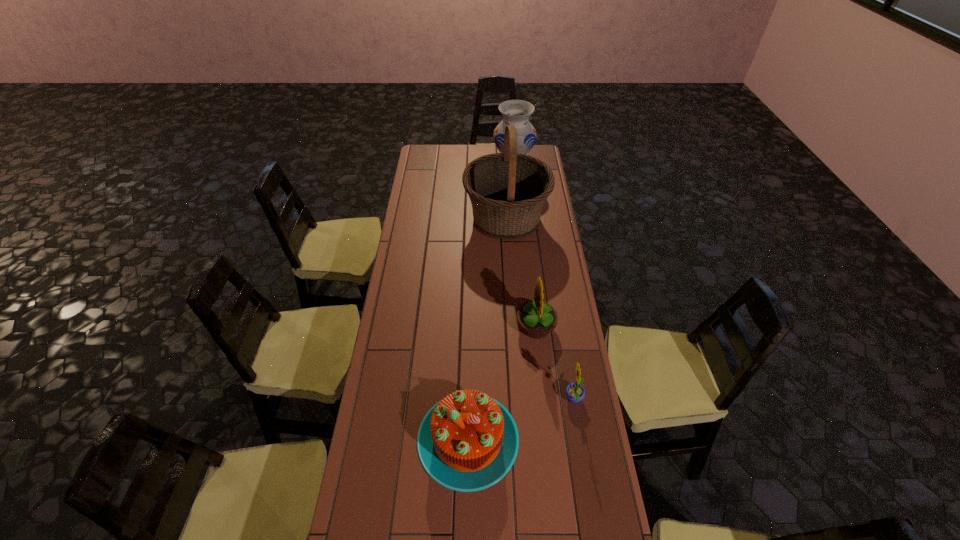
The height and width of the screenshot is (540, 960). I want to click on basket, so click(x=508, y=190).

Identify the location of the tallest object. This screenshot has height=540, width=960. (508, 190).

Where is `the second tallest object`? the second tallest object is located at coordinates pos(515,112).

This screenshot has width=960, height=540. Find the location of `the farthest object`. the farthest object is located at coordinates (515, 112).

You are a GUI agent. You are given a task and a screenshot of the screen. Output one action in this format:
    pyautogui.click(x=<x>, y=<y>)
    Task: Click on the third tallest object
    
    Given the screenshot: What is the action you would take?
    pyautogui.click(x=537, y=319)

Find the location of a particular element. the taller sunflower is located at coordinates [537, 319].

What are the coordinates of `the nearer sunflower` in the screenshot? It's located at [575, 392].

You are a GUI agent. You are given a task and a screenshot of the screen. Output one action in this format:
    pyautogui.click(x=<x>, y=<y>)
    Task: Click on the cake
    The height and width of the screenshot is (540, 960).
    Given the screenshot: What is the action you would take?
    pyautogui.click(x=468, y=441)

The height and width of the screenshot is (540, 960). Identify the location of vacant space located on the front of the basket. (509, 262).

Locate an element on the screen. Image resolution: width=960 pixels, height=540 pixels. free location located 0.300m on the front of the farthest object is located at coordinates (517, 209).